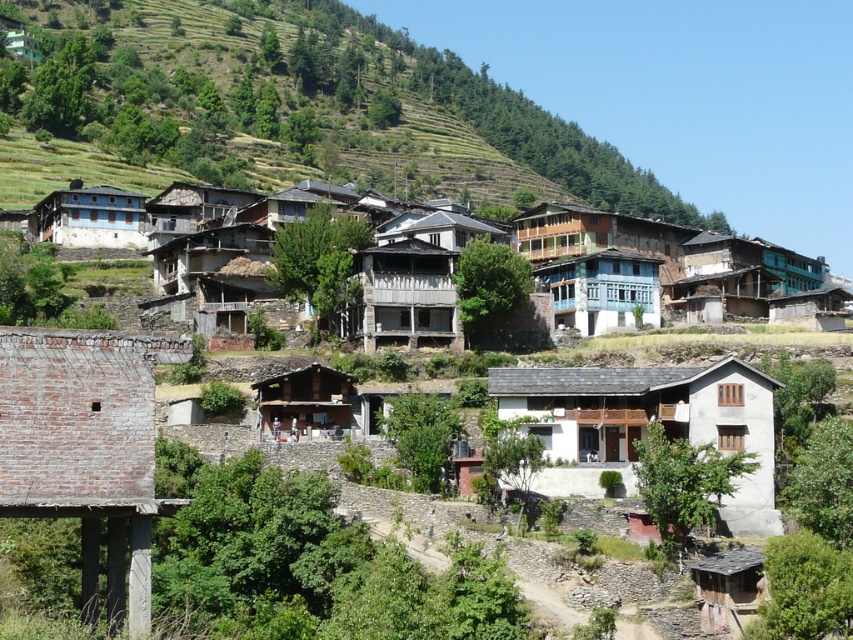
From the picture: Is brick wall at lower left thinner than wooden houses at center?

Indeed, brick wall at lower left has a lesser width compared to wooden houses at center.

Between brick wall at lower left and wooden houses at center, which one appears on the right side from the viewer's perspective?

Positioned to the right is wooden houses at center.

This screenshot has width=853, height=640. Find the location of `brick wall at lower left`. brick wall at lower left is located at coordinates (86, 445).

Consider the image. Does white concrete house at center have a larger size compared to wooden hut at center?

Correct, white concrete house at center is larger in size than wooden hut at center.

Which is more to the left, white concrete house at center or wooden hut at center?

wooden hut at center is more to the left.

Where is `white concrete house at center`? The height and width of the screenshot is (640, 853). white concrete house at center is located at coordinates (653, 419).

At what (x,y) coordinates should I click in order to perform the action: click on white concrete house at center. Please return your answer as a coordinate pair (x, y). The width and height of the screenshot is (853, 640). Looking at the image, I should click on (653, 419).

Which is behind, point (367, 268) or point (291, 420)?

The point (367, 268) is more distant.

This screenshot has width=853, height=640. Describe the element at coordinates (405, 294) in the screenshot. I see `wooden balcony at center` at that location.

Locate an element on the screen. This screenshot has width=853, height=640. wooden balcony at center is located at coordinates (405, 294).